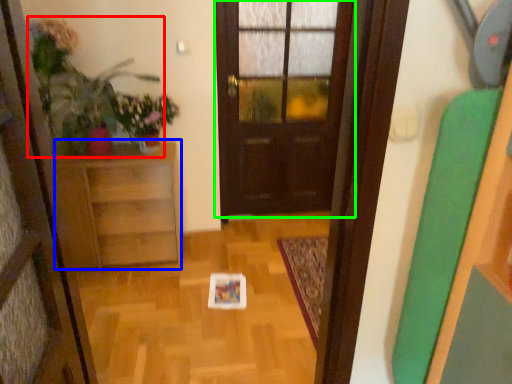
Question: Which object is the closest to the plant (highlighted by a red box)? Choose among these: furniture (highlighted by a blue box) or door (highlighted by a green box).

Choices:
 (A) furniture
 (B) door

Answer: (A)